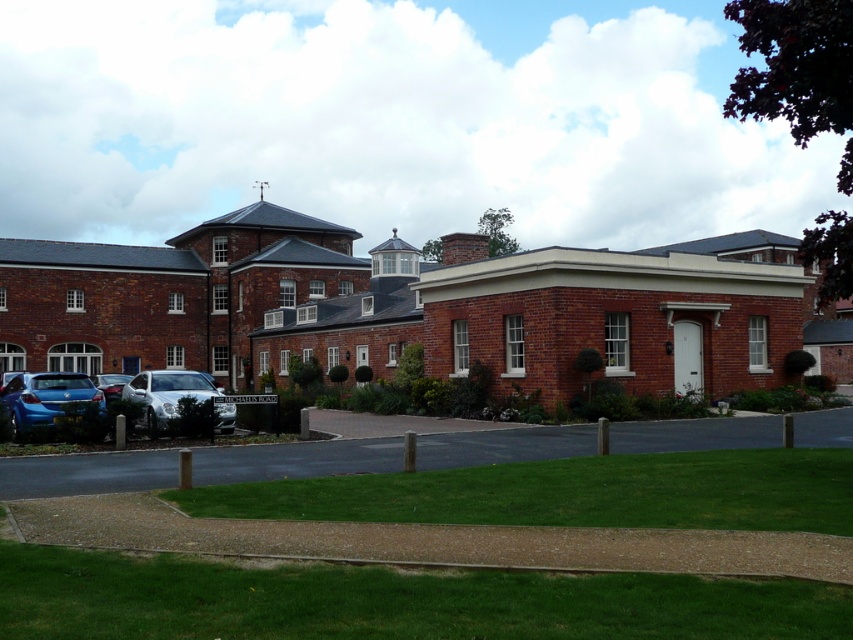
You are a visitor arriving at the brick building and need to park your car. You see a metallic blue sedan at lower left and a satin silver car at center. Which car is positioned closer to the parking lot entrance?

The metallic blue sedan at lower left is positioned to the right of the satin silver car at center, so the satin silver car at center is closer to the parking lot entrance.